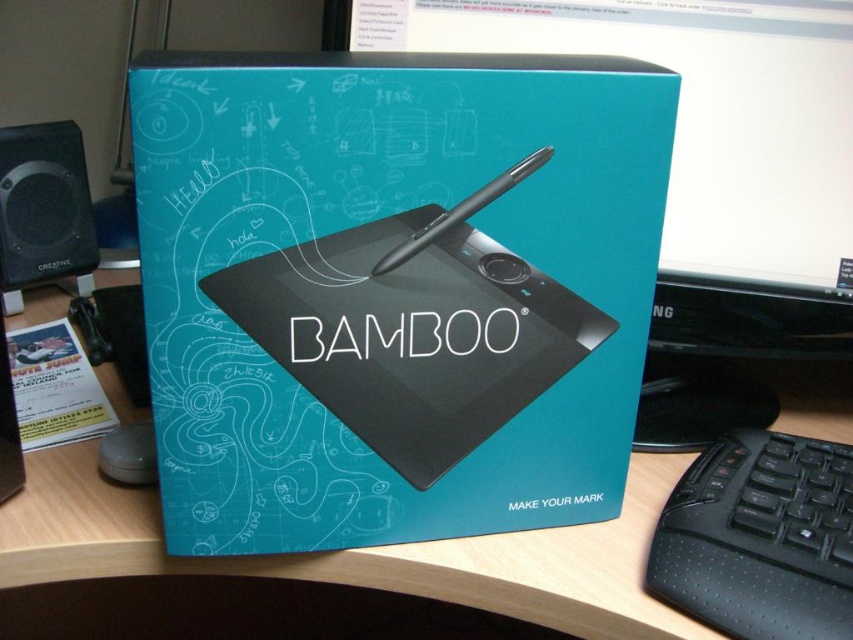
Between point (839, 204) and point (721, 618), which one is positioned behind?

The point (839, 204) is more distant.

Who is positioned more to the right, black glossy monitor at upper center or black rubberized keyboard at lower right?

From the viewer's perspective, black rubberized keyboard at lower right appears more on the right side.

Where is `black glossy monitor at upper center`? The image size is (853, 640). black glossy monitor at upper center is located at coordinates (701, 173).

You are a GUI agent. You are given a task and a screenshot of the screen. Output one action in this format:
    pyautogui.click(x=<x>, y=<y>)
    Task: Click on the black glossy monitor at upper center
    
    Given the screenshot: What is the action you would take?
    pyautogui.click(x=701, y=173)

Between black glossy monitor at upper center and wooden at center, which one is positioned higher?

black glossy monitor at upper center is above.

Is point (825, 8) positioned in front of point (840, 433)?

Yes, point (825, 8) is closer to viewer.

Locate an element on the screen. The height and width of the screenshot is (640, 853). black glossy monitor at upper center is located at coordinates (701, 173).

Measure the distance between black rubberized keyboard at lower right and black plastic speaker at left.

They are 27.35 inches apart.

Which is in front, point (784, 445) or point (45, 157)?

Point (784, 445) is more forward.

What are the coordinates of `black rubberized keyboard at lower right` in the screenshot? It's located at pyautogui.click(x=759, y=538).